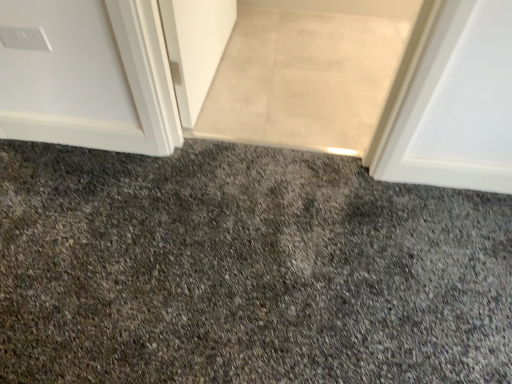
Question: Does point (259, 306) appear closer or farther from the camera than point (278, 39)?

Choices:
 (A) farther
 (B) closer

Answer: (B)

Question: From the image's perspective, is gray textured carpet at center located above or below gray carpet at center?

Choices:
 (A) below
 (B) above

Answer: (A)

Question: Considering the positions of gray textured carpet at center and gray carpet at center in the image, is gray textured carpet at center taller or shorter than gray carpet at center?

Choices:
 (A) tall
 (B) short

Answer: (B)

Question: From a real-world perspective, is gray carpet at center positioned above or below gray textured carpet at center?

Choices:
 (A) above
 (B) below

Answer: (B)

Question: Is gray carpet at center situated inside gray textured carpet at center or outside?

Choices:
 (A) outside
 (B) inside

Answer: (A)

Question: Is gray carpet at center bigger or smaller than gray textured carpet at center?

Choices:
 (A) big
 (B) small

Answer: (B)

Question: Considering their positions, is gray carpet at center located in front of or behind gray textured carpet at center?

Choices:
 (A) behind
 (B) front

Answer: (A)